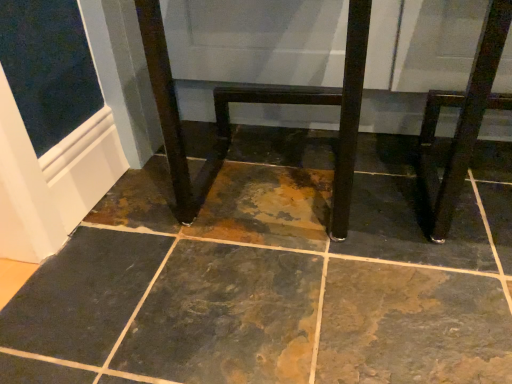
At what (x,y) coordinates should I click in order to perform the action: click on vacant region to the left of shiny dark wood stool at right. Please return your answer as a coordinate pair (x, y). Looking at the image, I should click on (379, 228).